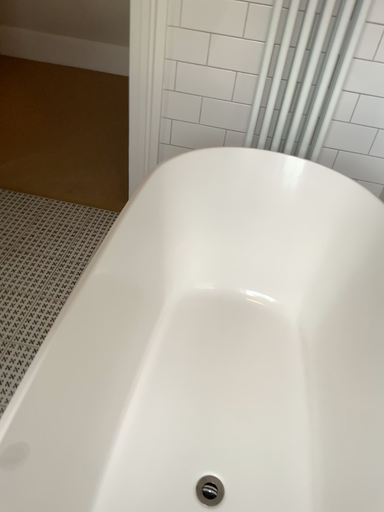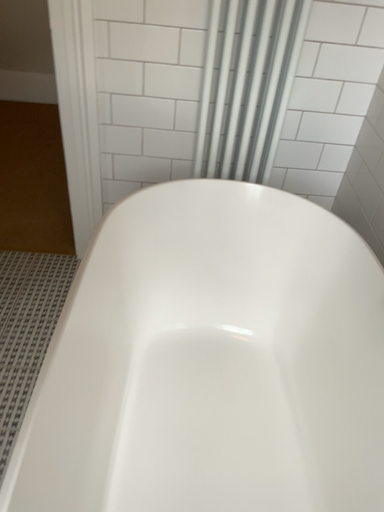
Question: How did the camera likely rotate when shooting the video?

Choices:
 (A) rotated left
 (B) rotated right

Answer: (B)